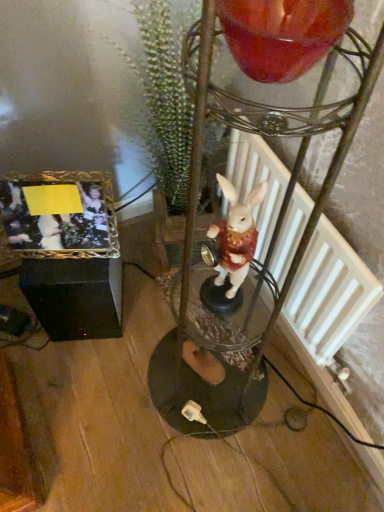
Question: Is gold metallic photo frame at lower left to the right of white matte radiator at center-right from the viewer's perspective?

Choices:
 (A) yes
 (B) no

Answer: (B)

Question: Considering the relative sizes of gold metallic photo frame at lower left and white matte radiator at center-right in the image provided, is gold metallic photo frame at lower left shorter than white matte radiator at center-right?

Choices:
 (A) yes
 (B) no

Answer: (A)

Question: Considering the relative positions of gold metallic photo frame at lower left and white matte radiator at center-right in the image provided, is gold metallic photo frame at lower left behind white matte radiator at center-right?

Choices:
 (A) no
 (B) yes

Answer: (B)

Question: From a real-world perspective, is gold metallic photo frame at lower left physically above white matte radiator at center-right?

Choices:
 (A) no
 (B) yes

Answer: (B)

Question: From a real-world perspective, is gold metallic photo frame at lower left under white matte radiator at center-right?

Choices:
 (A) yes
 (B) no

Answer: (B)

Question: Is shiny glass candle at upper center in front of or behind gold metallic photo frame at lower left in the image?

Choices:
 (A) behind
 (B) front

Answer: (B)

Question: Is point (297, 53) closer or farther from the camera than point (13, 204)?

Choices:
 (A) farther
 (B) closer

Answer: (B)

Question: Is shiny glass candle at upper center inside or outside of gold metallic photo frame at lower left?

Choices:
 (A) inside
 (B) outside

Answer: (B)

Question: From a real-world perspective, is shiny glass candle at upper center physically located above or below gold metallic photo frame at lower left?

Choices:
 (A) below
 (B) above

Answer: (B)

Question: Does point (1, 219) appear closer or farther from the camera than point (253, 224)?

Choices:
 (A) farther
 (B) closer

Answer: (A)

Question: Visually, is gold metallic photo frame at lower left positioned to the left or to the right of white porcelain rabbit at center?

Choices:
 (A) left
 (B) right

Answer: (A)

Question: Looking at their shapes, would you say gold metallic photo frame at lower left is wider or thinner than white porcelain rabbit at center?

Choices:
 (A) thin
 (B) wide

Answer: (A)

Question: Do you think gold metallic photo frame at lower left is within white porcelain rabbit at center, or outside of it?

Choices:
 (A) outside
 (B) inside

Answer: (A)

Question: From the image's perspective, is white porcelain rabbit at center located above or below green textured plant at center?

Choices:
 (A) below
 (B) above

Answer: (A)

Question: Considering the positions of white porcelain rabbit at center and green textured plant at center in the image, is white porcelain rabbit at center wider or thinner than green textured plant at center?

Choices:
 (A) wide
 (B) thin

Answer: (B)